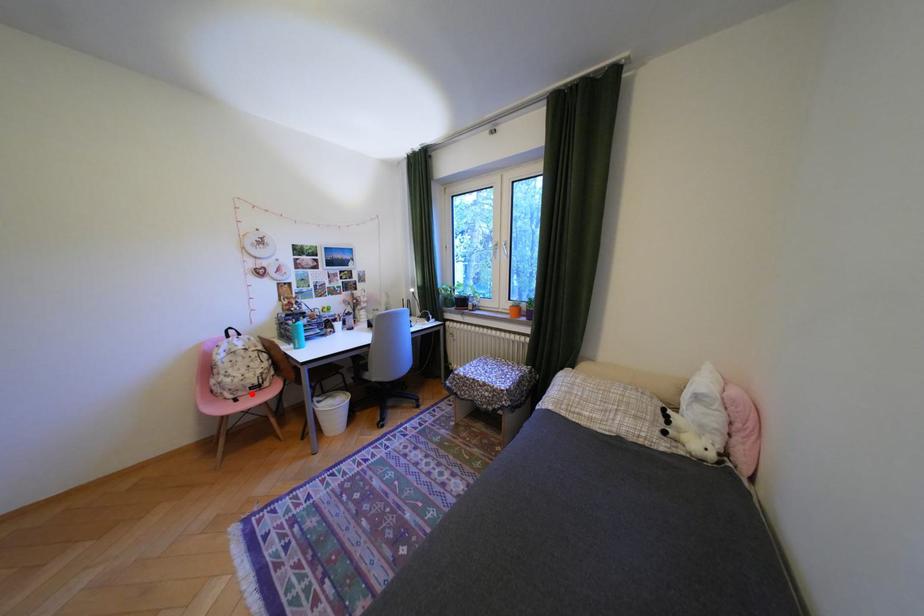
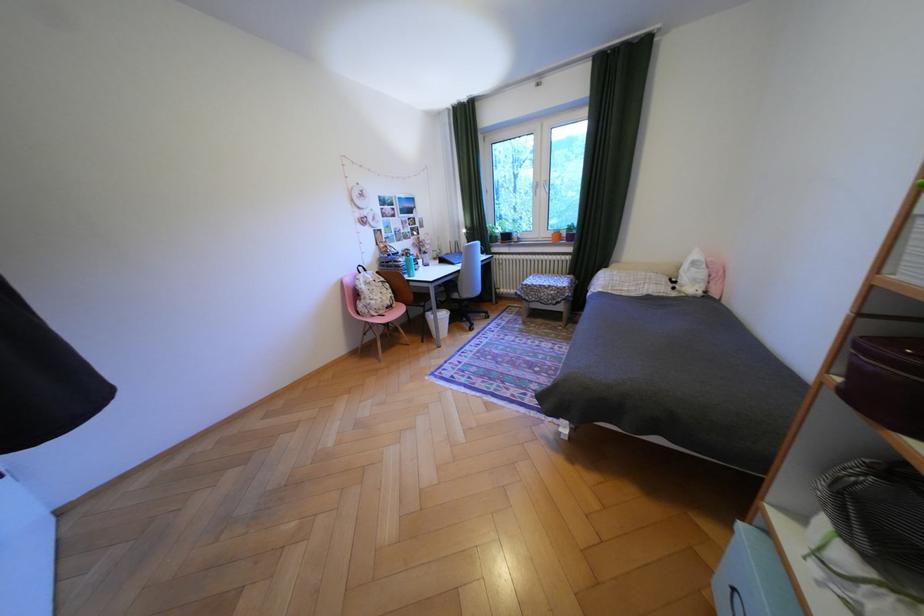
Question: I am providing you with two images of the same scene from different viewpoints. Given a red point in image1, look at the same physical point in image2. Is it:

Choices:
 (A) Closer to the viewpoint
 (B) Farther from the viewpoint

Answer: (A)